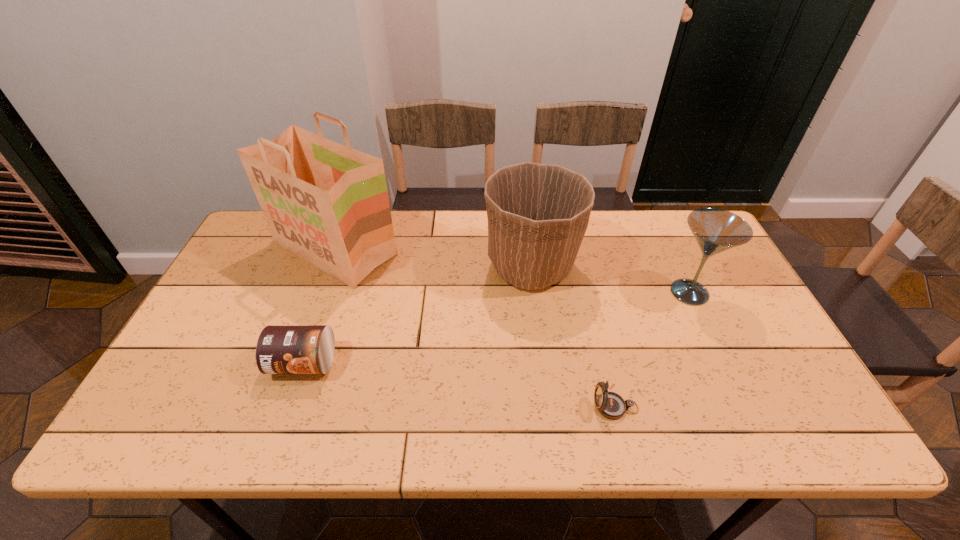
Locate an element on the screen. free space between the tallest object and the second nearest object is located at coordinates (320, 306).

The width and height of the screenshot is (960, 540). What are the coordinates of `free space between the second tallest object and the compass` in the screenshot? It's located at (573, 337).

Select which object is the third closest to the grocery bag. Please provide its 2D coordinates. Your answer should be formatted as a tuple, i.e. [(x, y)], where the tuple contains the x and y coordinates of a point satisfying the conditions above.

[(611, 405)]

Locate an element on the screen. object that is the second closest to the nearest object is located at coordinates (715, 230).

Image resolution: width=960 pixels, height=540 pixels. Find the location of `free location that satisfies the following two spatial constraints: 1. on the front side of the martini; 2. on the face of the compass`. free location that satisfies the following two spatial constraints: 1. on the front side of the martini; 2. on the face of the compass is located at coordinates (744, 407).